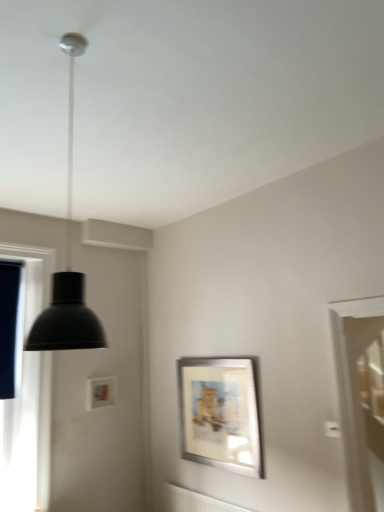
Question: Is point (364, 353) closer or farther from the camera than point (79, 287)?

Choices:
 (A) closer
 (B) farther

Answer: (B)

Question: Considering the positions of white glossy screen door at right and matte black pendant light at upper left in the image, is white glossy screen door at right wider or thinner than matte black pendant light at upper left?

Choices:
 (A) wide
 (B) thin

Answer: (A)

Question: Considering the real-world distances, which object is farthest from the white glossy screen door at right?

Choices:
 (A) matte black pendant light at upper left
 (B) silver metallic picture frame at center

Answer: (A)

Question: Considering the real-world distances, which object is closest to the silver metallic picture frame at center?

Choices:
 (A) matte black pendant light at upper left
 (B) white glossy screen door at right

Answer: (B)